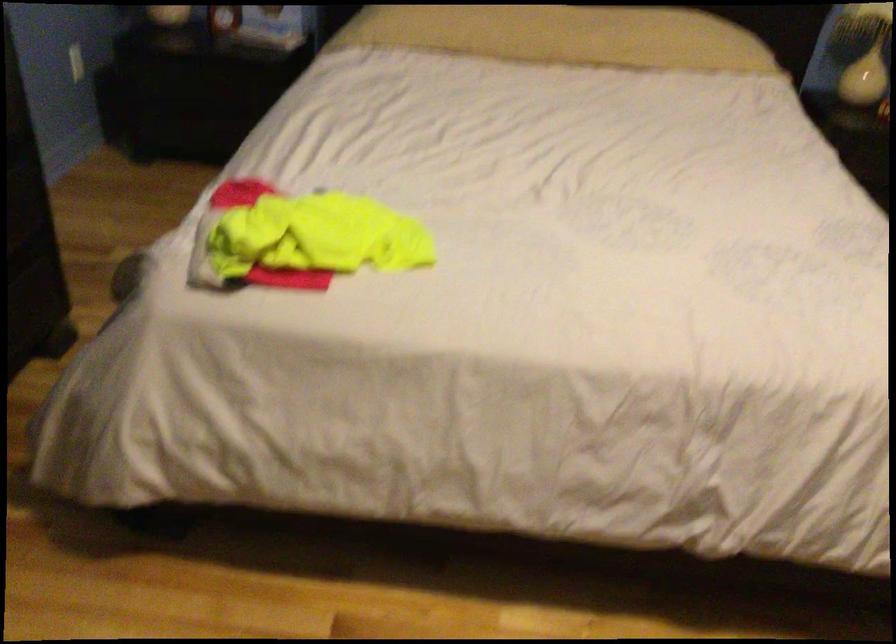
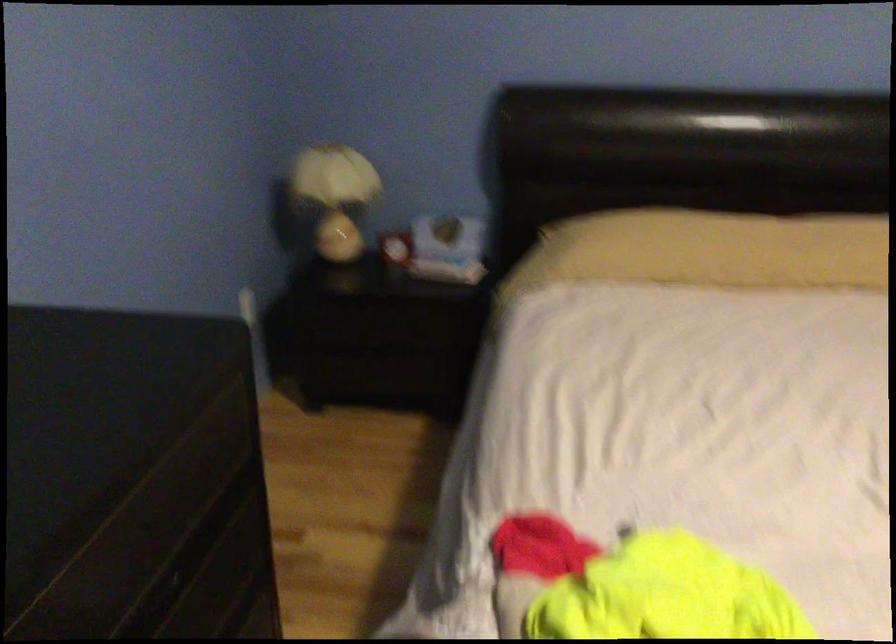
The images are taken continuously from a first-person perspective. In which direction are you moving?

The movement direction of the cameraman is left, forward.